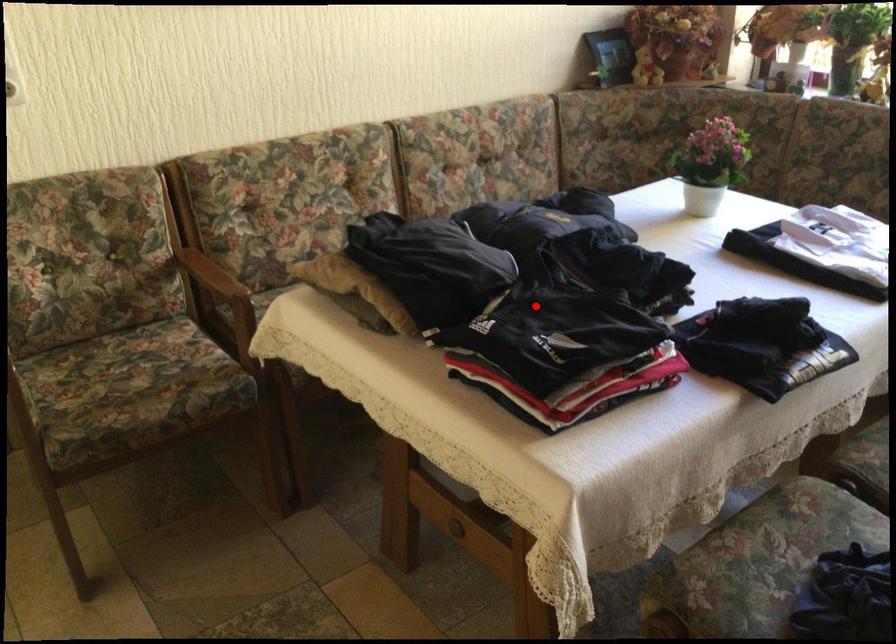
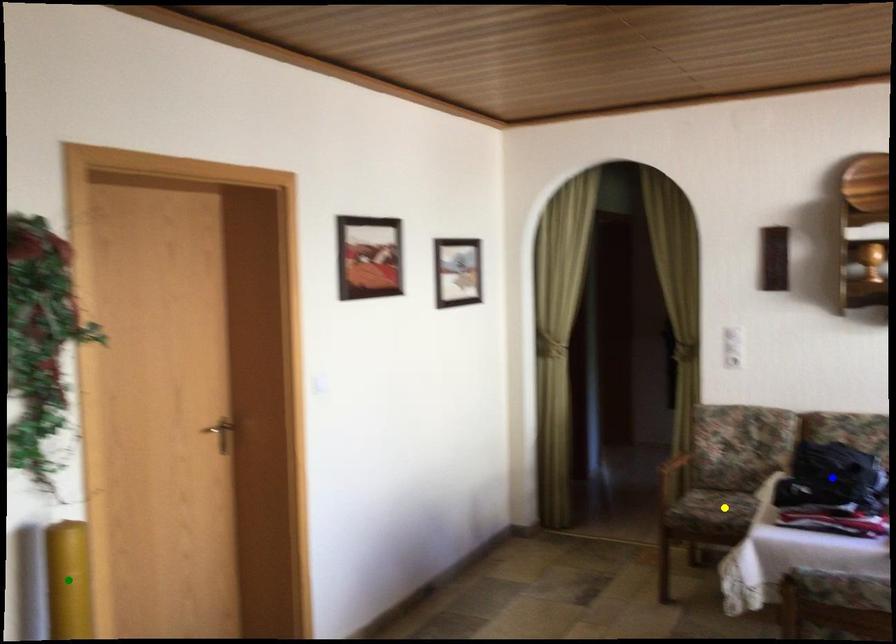
Question: I am providing you with two images of the same scene from different viewpoints. A red point is marked on the first image. You are given multiple points on the second image. Which point in image 2 represents the same 3d spot as the red point in image 1?

Choices:
 (A) blue point
 (B) yellow point
 (C) green point

Answer: (A)